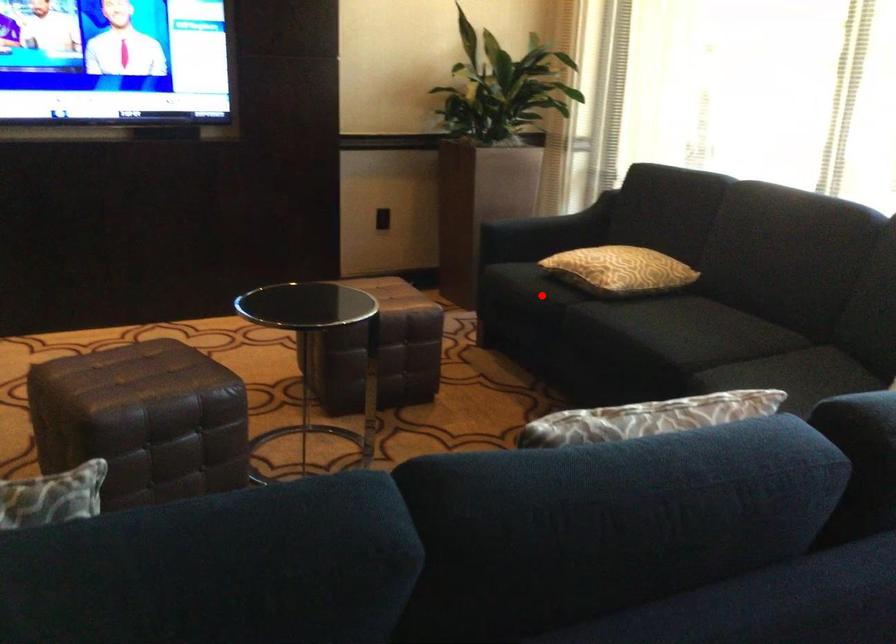
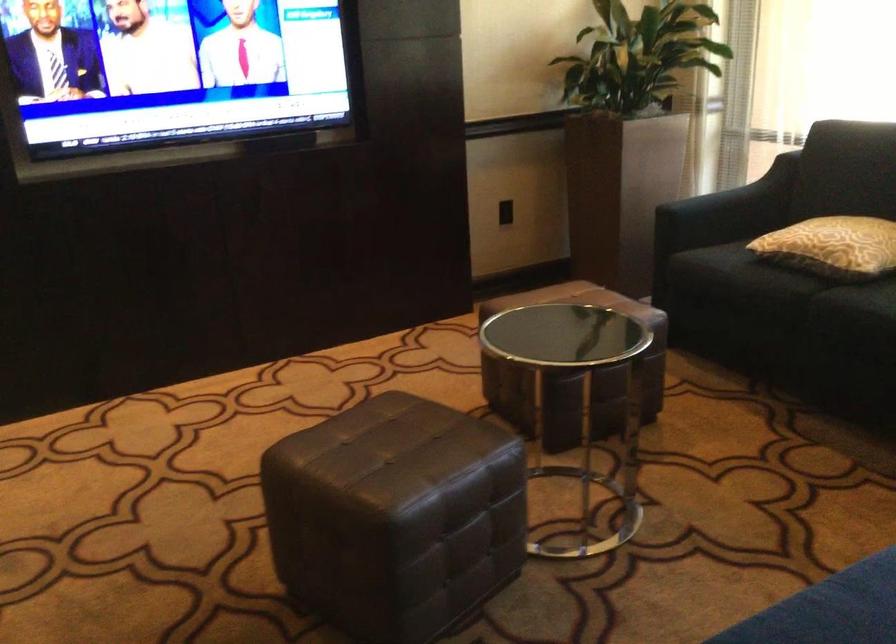
Question: I am providing you with two images of the same scene from different viewpoints. In image1, a red point is highlighted. Considering the same 3D point in image2, which of the following is correct?

Choices:
 (A) It is closer
 (B) It is farther

Answer: (A)